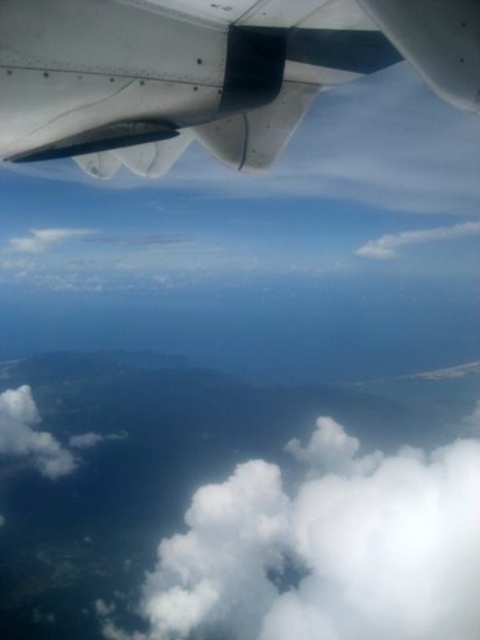
Question: Does metallic gray wing at upper left have a larger size compared to white fluffy cloud at lower center?

Choices:
 (A) yes
 (B) no

Answer: (B)

Question: Which object is farther from the camera taking this photo?

Choices:
 (A) white fluffy cloud at lower center
 (B) metallic gray wing at upper left

Answer: (A)

Question: Can you confirm if metallic gray wing at upper left is positioned below white fluffy cloud at lower center?

Choices:
 (A) no
 (B) yes

Answer: (A)

Question: Can you confirm if metallic gray wing at upper left is thinner than white fluffy cloud at lower center?

Choices:
 (A) yes
 (B) no

Answer: (A)